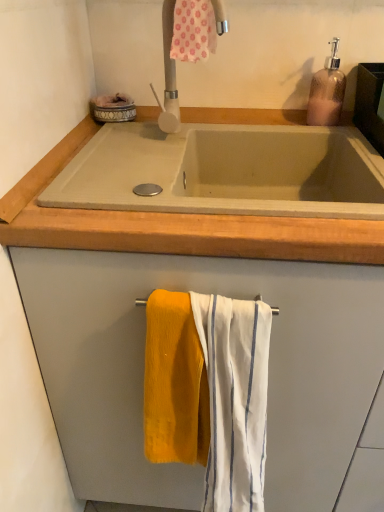
Where is `free space in front of translucent brown soap dispenser at upper right`? The image size is (384, 512). free space in front of translucent brown soap dispenser at upper right is located at coordinates (340, 135).